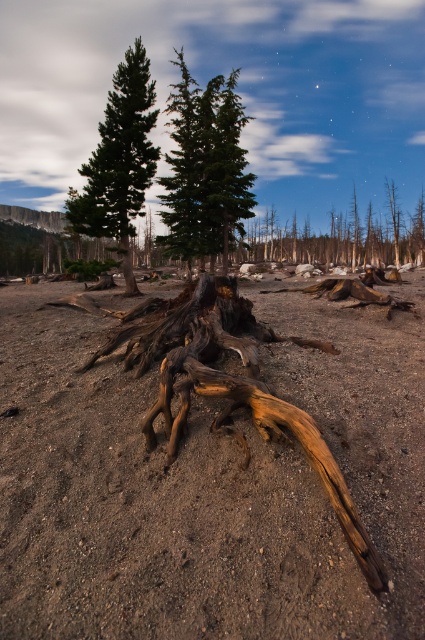
Is point (178, 120) in front of point (129, 276)?

That is False.

Can you confirm if green matte tree at center is taller than brown rough tree trunk at center?

Yes, green matte tree at center is taller than brown rough tree trunk at center.

Who is more forward, [229,106] or [132,268]?

Point [132,268] is in front.

Where is `green matte tree at center`? Image resolution: width=425 pixels, height=640 pixels. green matte tree at center is located at coordinates (204, 168).

Which of these two, green matte tree at upper left or charred wood tree stump at center, stands shorter?

green matte tree at upper left is shorter.

How distant is green matte tree at upper left from charred wood tree stump at center?

157.11 feet

Find the location of `green matte tree at upper left`. green matte tree at upper left is located at coordinates (119, 161).

Between point (384, 556) and point (119, 237), which one is positioned behind?

The point (119, 237) is behind.

Does brown dirt field at center appear on the right side of brown rough tree trunk at center?

Correct, you'll find brown dirt field at center to the right of brown rough tree trunk at center.

Find the location of a particular element. brown dirt field at center is located at coordinates (209, 483).

Identify the location of brown dirt field at center. This screenshot has width=425, height=640. (209, 483).